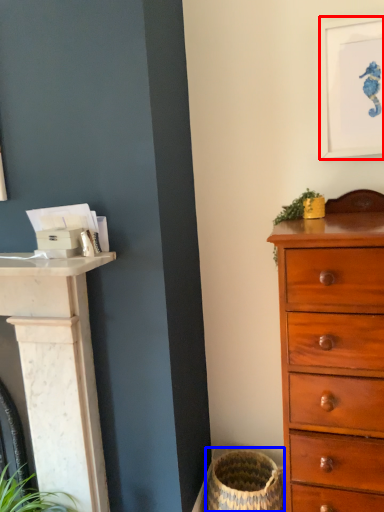
Question: Which point is closer to the camera, picture frame (highlighted by a red box) or basket container (highlighted by a blue box)?

Choices:
 (A) picture frame
 (B) basket container

Answer: (A)